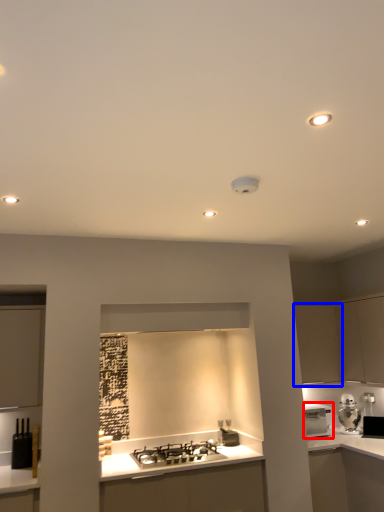
Question: Which point is further to the camera, home appliance (highlighted by a red box) or cabinetry (highlighted by a blue box)?

Choices:
 (A) home appliance
 (B) cabinetry

Answer: (B)